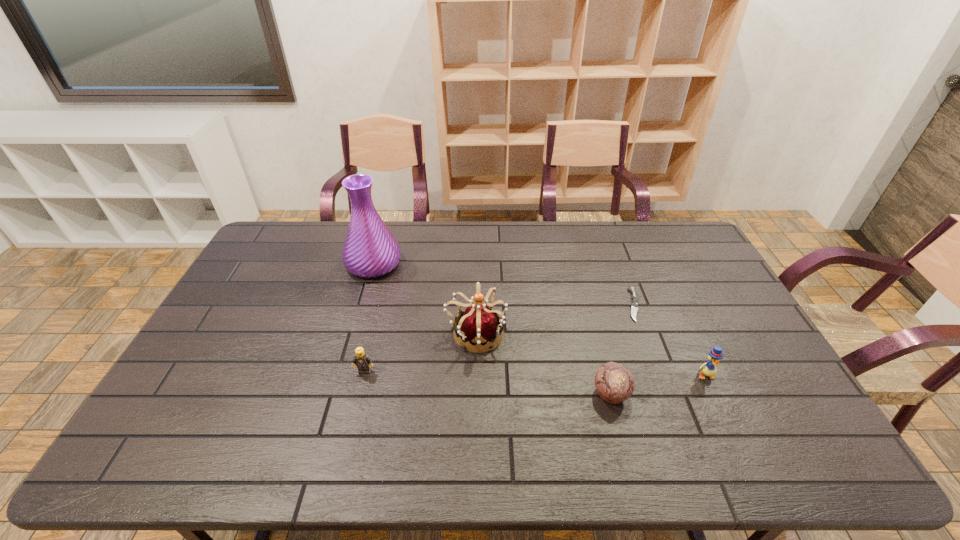
Select which object appears as the fifth closest to the second object from right to left. Please provide its 2D coordinates. Your answer should be formatted as a tuple, i.e. [(x, y)], where the tuple contains the x and y coordinates of a point satisfying the conditions above.

[(361, 360)]

The image size is (960, 540). I want to click on object that stands as the third closest to the muffin, so click(x=478, y=324).

Where is `vacant space that satisfies the following two spatial constraints: 1. in front of the muffin; 2. on the right side of the Lego`? This screenshot has width=960, height=540. vacant space that satisfies the following two spatial constraints: 1. in front of the muffin; 2. on the right side of the Lego is located at coordinates (359, 394).

Find the location of a particular element. The image size is (960, 540). vacant space that satisfies the following two spatial constraints: 1. on the front-facing side of the tiara; 2. in front of the Lego is located at coordinates (475, 371).

The width and height of the screenshot is (960, 540). In order to click on free space that satisfies the following two spatial constraints: 1. on the front-facing side of the third object from right to left; 2. on the right side of the fifth shortest object in this screenshot , I will do `click(475, 394)`.